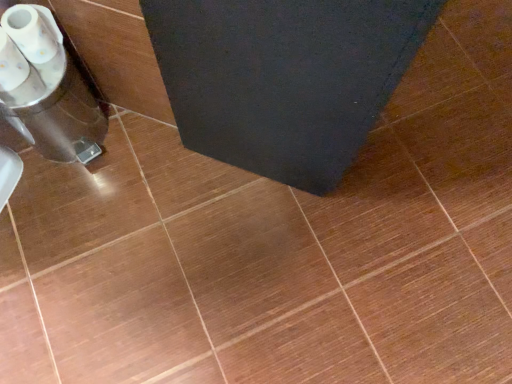
Question: From a real-world perspective, is translucent plastic cups at left on top of white glossy toilet paper at lower left?

Choices:
 (A) yes
 (B) no

Answer: (B)

Question: Are translucent plastic cups at left and white glossy toilet paper at lower left located far from each other?

Choices:
 (A) yes
 (B) no

Answer: (B)

Question: Considering the relative positions of translucent plastic cups at left and white glossy toilet paper at lower left in the image provided, is translucent plastic cups at left to the left of white glossy toilet paper at lower left from the viewer's perspective?

Choices:
 (A) no
 (B) yes

Answer: (B)

Question: From the image's perspective, is translucent plastic cups at left beneath white glossy toilet paper at lower left?

Choices:
 (A) no
 (B) yes

Answer: (B)

Question: Are translucent plastic cups at left and white glossy toilet paper at lower left making contact?

Choices:
 (A) no
 (B) yes

Answer: (A)

Question: Is the position of translucent plastic cups at left less distant than that of white glossy toilet paper at lower left?

Choices:
 (A) yes
 (B) no

Answer: (B)

Question: From a real-world perspective, is white glossy toilet paper at lower left physically below translucent plastic cups at left?

Choices:
 (A) no
 (B) yes

Answer: (A)

Question: Is white glossy toilet paper at lower left in front of translucent plastic cups at left?

Choices:
 (A) yes
 (B) no

Answer: (A)

Question: Is white glossy toilet paper at lower left to the left of translucent plastic cups at left from the viewer's perspective?

Choices:
 (A) no
 (B) yes

Answer: (A)

Question: From the image's perspective, is white glossy toilet paper at lower left located beneath translucent plastic cups at left?

Choices:
 (A) yes
 (B) no

Answer: (B)

Question: Is white glossy toilet paper at lower left surrounding translucent plastic cups at left?

Choices:
 (A) yes
 (B) no

Answer: (B)

Question: Is white glossy toilet paper at lower left taller than translucent plastic cups at left?

Choices:
 (A) yes
 (B) no

Answer: (B)

Question: Does point (41, 33) appear closer or farther from the camera than point (35, 39)?

Choices:
 (A) closer
 (B) farther

Answer: (B)